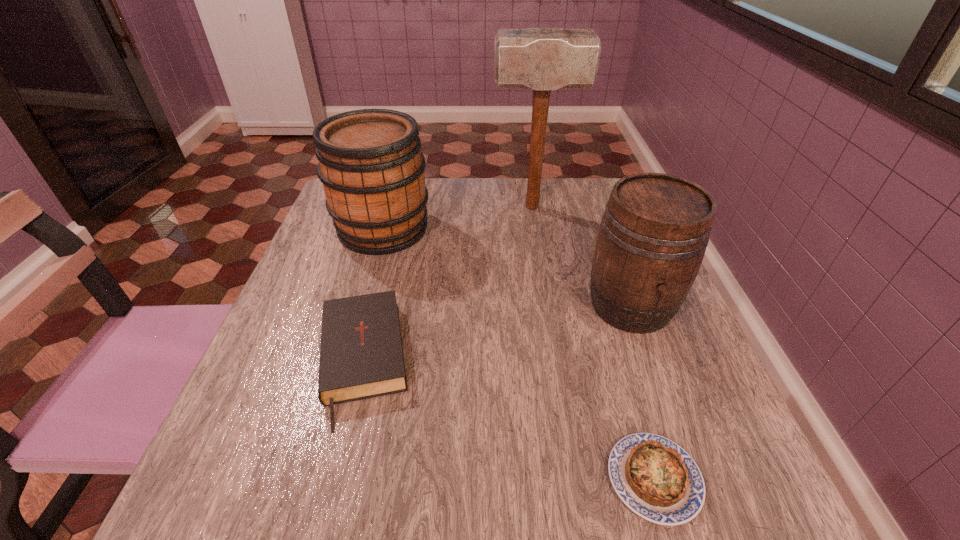
I want to click on vacant space in between the nearer cider and the mallet, so click(582, 256).

Find the location of a particular element. Image resolution: width=960 pixels, height=540 pixels. empty space between the fourth tallest object and the nearest object is located at coordinates (508, 420).

Identify the location of unoccupied position between the farther cider and the tallest object. This screenshot has height=540, width=960. (458, 218).

Locate an element on the screen. This screenshot has width=960, height=540. vacant area that lies between the nearest object and the left cider is located at coordinates (518, 354).

This screenshot has height=540, width=960. In order to click on free space between the nearer cider and the left cider in this screenshot , I will do `click(507, 267)`.

What are the coordinates of `vacant region between the left cider and the right cider` in the screenshot? It's located at (507, 267).

At what (x,y) coordinates should I click in order to perform the action: click on vacant point located between the quiche and the Bible. Please return your answer as a coordinate pair (x, y). Looking at the image, I should click on (508, 420).

Identify the location of empty space that is in between the mallet and the shortest object. The height and width of the screenshot is (540, 960). (593, 343).

You are a GUI agent. You are given a task and a screenshot of the screen. Output one action in this format:
    pyautogui.click(x=<x>, y=<y>)
    Task: Click on the empty location between the tallest object and the left cider
    
    Given the screenshot: What is the action you would take?
    click(458, 218)

Choose which object is the second nearest neighbor to the farther cider. Please provide its 2D coordinates. Your answer should be formatted as a tuple, i.e. [(x, y)], where the tuple contains the x and y coordinates of a point satisfying the conditions above.

[(540, 59)]